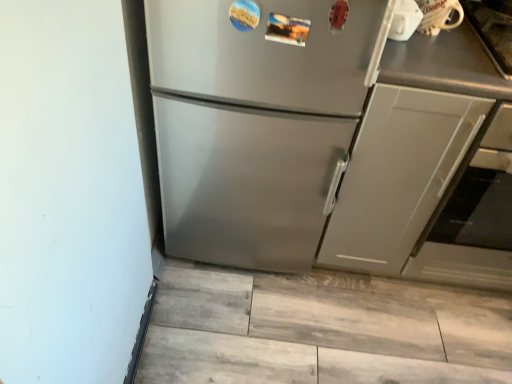
Question: From a real-world perspective, is matte gray cabinet at right located higher than satin silver refrigerator at center?

Choices:
 (A) no
 (B) yes

Answer: (A)

Question: From a real-world perspective, is matte gray cabinet at right positioned under satin silver refrigerator at center based on gravity?

Choices:
 (A) yes
 (B) no

Answer: (A)

Question: Are matte gray cabinet at right and satin silver refrigerator at center located far from each other?

Choices:
 (A) no
 (B) yes

Answer: (A)

Question: Does matte gray cabinet at right turn towards satin silver refrigerator at center?

Choices:
 (A) no
 (B) yes

Answer: (A)

Question: Is matte gray cabinet at right at the right side of satin silver refrigerator at center?

Choices:
 (A) yes
 (B) no

Answer: (A)

Question: Would you say satin gray oven at right is to the left or to the right of satin silver refrigerator at center in the picture?

Choices:
 (A) left
 (B) right

Answer: (B)

Question: Looking at their shapes, would you say satin gray oven at right is wider or thinner than satin silver refrigerator at center?

Choices:
 (A) wide
 (B) thin

Answer: (A)

Question: Is point (471, 165) closer or farther from the camera than point (273, 157)?

Choices:
 (A) closer
 (B) farther

Answer: (A)

Question: From the image's perspective, is satin gray oven at right positioned above or below satin silver refrigerator at center?

Choices:
 (A) above
 (B) below

Answer: (B)

Question: Looking at their shapes, would you say white glossy mug at upper right is wider or thinner than satin silver refrigerator at center?

Choices:
 (A) wide
 (B) thin

Answer: (B)

Question: From the image's perspective, relative to satin silver refrigerator at center, is white glossy mug at upper right above or below?

Choices:
 (A) below
 (B) above

Answer: (B)

Question: Considering the relative positions of white glossy mug at upper right and satin silver refrigerator at center in the image provided, is white glossy mug at upper right to the left or to the right of satin silver refrigerator at center?

Choices:
 (A) left
 (B) right

Answer: (B)

Question: Is white glossy mug at upper right taller or shorter than satin silver refrigerator at center?

Choices:
 (A) tall
 (B) short

Answer: (B)

Question: In the image, is matte gray cabinet at right positioned in front of or behind white glossy mug at upper right?

Choices:
 (A) front
 (B) behind

Answer: (A)

Question: From a real-world perspective, is matte gray cabinet at right above or below white glossy mug at upper right?

Choices:
 (A) above
 (B) below

Answer: (B)